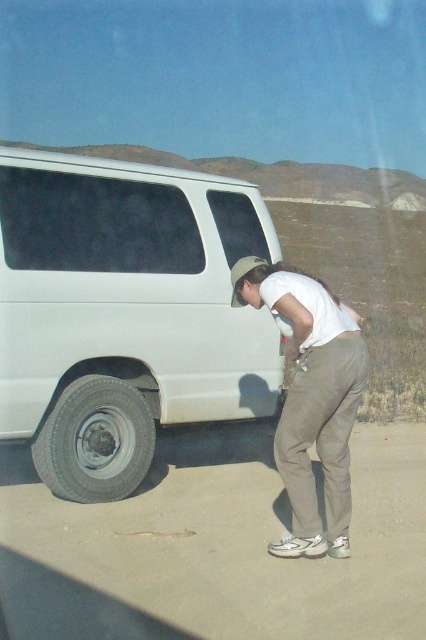
Is white cotton shirt at center in front of gray rubber tire at lower left?

That is True.

Locate an element on the screen. This screenshot has width=426, height=640. white cotton shirt at center is located at coordinates (310, 400).

Does white matte van at left come behind gray rubber tire at lower left?

That is False.

Looking at this image, does white matte van at left have a lesser height compared to gray rubber tire at lower left?

In fact, white matte van at left may be taller than gray rubber tire at lower left.

Where is `white matte van at left`? white matte van at left is located at coordinates (124, 312).

This screenshot has height=640, width=426. I want to click on white matte van at left, so click(x=124, y=312).

Locate an element on the screen. white matte van at left is located at coordinates click(x=124, y=312).